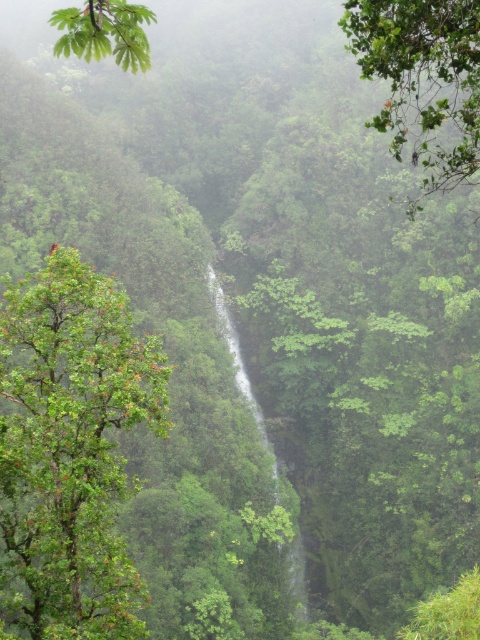
You are a hiker trying to navigate through the dense tropical vegetation. You see a green leafy tree at left and a green leafy tree at upper center. Which tree is closer to the ground?

The green leafy tree at left is closer to the ground because it is positioned below the green leafy tree at upper center.

You are an explorer navigating through the dense tropical forest. You see a green leafy tree at left and a green leafy tree at upper center. Which tree is shorter?

The green leafy tree at left is shorter than the green leafy tree at upper center.

You are a hiker trying to navigate between two green leafy trees in a dense forest. You see the green leafy tree at upper center and the green leafy tree at upper left. How far apart are these two trees?

The distance between the green leafy tree at upper center and the green leafy tree at upper left is 49.92 meters.